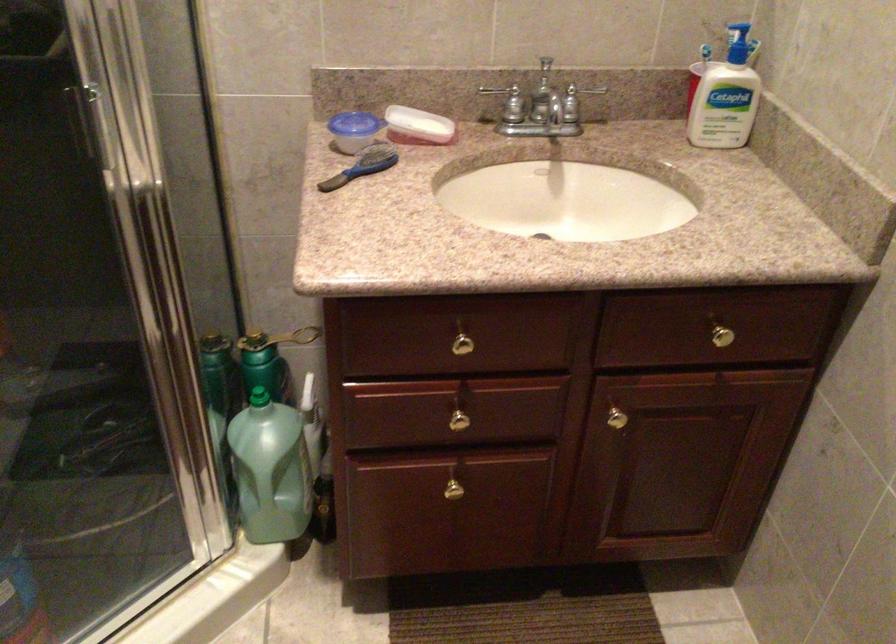
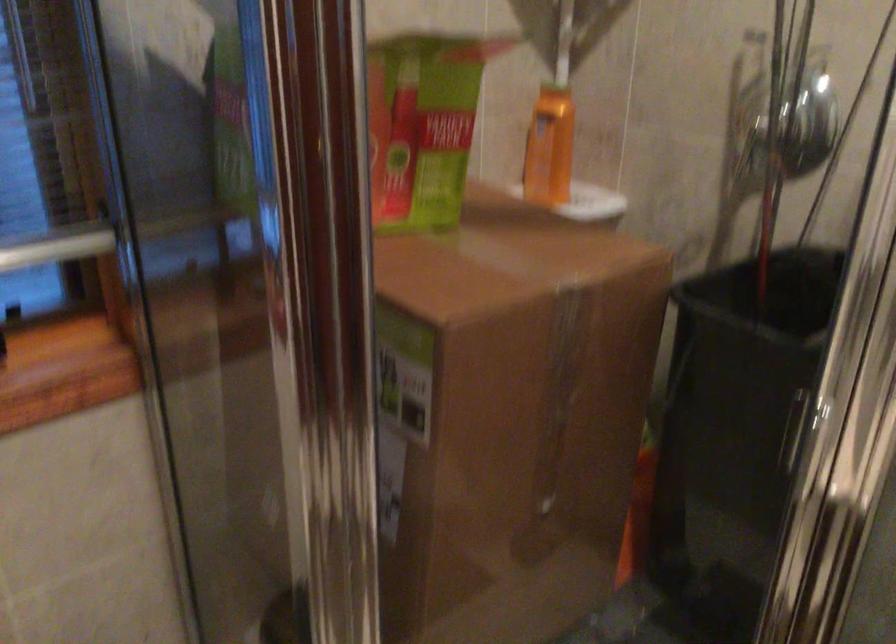
Question: Based on the continuous images, in which direction is the camera rotating? Reply with the corresponding letter.

Choices:
 (A) Left
 (B) Right
 (C) Up
 (D) Down

Answer: (A)